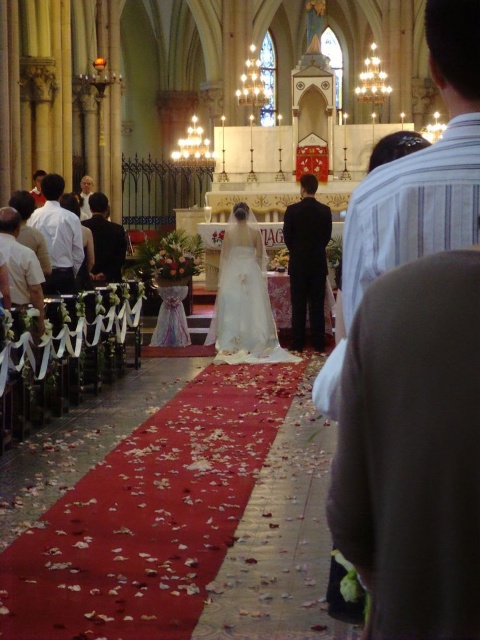
You are a photographer at the wedding ceremony. You need to capture a closeup shot of the white satin dress at center and the white cotton shirt at left. Which one requires more space in the frame to fully capture?

The white satin dress at center requires more space in the frame because it has a larger size compared to the white cotton shirt at left.

You are a photographer at the wedding and need to decide which suit to focus on for a closeup. Since the black satin suit at center is narrower than the black matte suit at left, which one would you choose to fit entirely in the camera frame if the frame can only accommodate the width of the wider suit?

The black matte suit at left is wider, so focusing on it would ensure it fits entirely within the camera frame since it matches the maximum width the frame can accommodate.